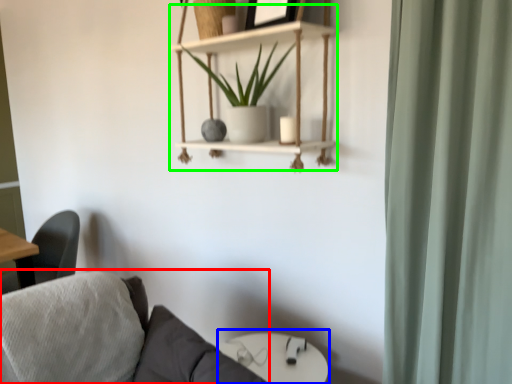
Question: Which object is positioned farthest from studio couch (highlighted by a red box)? Select from round table (highlighted by a blue box) and cabinet (highlighted by a green box).

Choices:
 (A) round table
 (B) cabinet

Answer: (B)